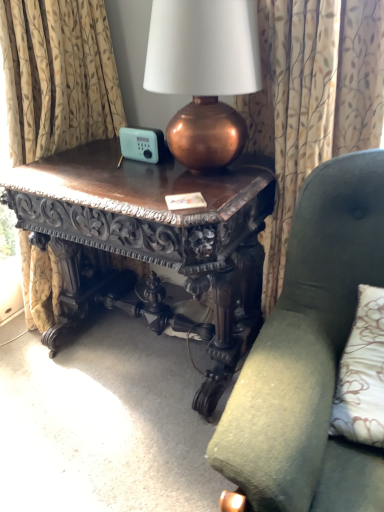
Question: Is patterned fabric curtain at upper center taller than polished dark wood table at center?

Choices:
 (A) no
 (B) yes

Answer: (B)

Question: From the image's perspective, would you say patterned fabric curtain at upper center is positioned over polished dark wood table at center?

Choices:
 (A) yes
 (B) no

Answer: (A)

Question: Is patterned fabric curtain at upper center positioned in front of polished dark wood table at center?

Choices:
 (A) no
 (B) yes

Answer: (B)

Question: Is patterned fabric curtain at upper center turned away from polished dark wood table at center?

Choices:
 (A) yes
 (B) no

Answer: (A)

Question: Can polished dark wood table at center be found inside patterned fabric curtain at upper center?

Choices:
 (A) yes
 (B) no

Answer: (B)

Question: Considering their positions, is patterned fabric curtain at upper center located in front of or behind polished dark wood table at center?

Choices:
 (A) front
 (B) behind

Answer: (A)

Question: Is patterned fabric curtain at upper center inside the boundaries of polished dark wood table at center, or outside?

Choices:
 (A) inside
 (B) outside

Answer: (B)

Question: Considering the positions of patterned fabric curtain at upper center and polished dark wood table at center in the image, is patterned fabric curtain at upper center wider or thinner than polished dark wood table at center?

Choices:
 (A) wide
 (B) thin

Answer: (B)

Question: In the image, is patterned fabric curtain at upper center on the left side or the right side of polished dark wood table at center?

Choices:
 (A) left
 (B) right

Answer: (B)

Question: From a real-world perspective, is copper metallic lamp at upper center above or below polished dark wood table at center?

Choices:
 (A) below
 (B) above

Answer: (B)

Question: In terms of height, does copper metallic lamp at upper center look taller or shorter compared to polished dark wood table at center?

Choices:
 (A) tall
 (B) short

Answer: (B)

Question: Is copper metallic lamp at upper center wider or thinner than polished dark wood table at center?

Choices:
 (A) wide
 (B) thin

Answer: (B)

Question: From the image's perspective, is copper metallic lamp at upper center located above or below polished dark wood table at center?

Choices:
 (A) above
 (B) below

Answer: (A)

Question: From the image's perspective, is green fabric chair at center above or below polished dark wood table at center?

Choices:
 (A) below
 (B) above

Answer: (A)

Question: Considering the positions of green fabric chair at center and polished dark wood table at center in the image, is green fabric chair at center wider or thinner than polished dark wood table at center?

Choices:
 (A) wide
 (B) thin

Answer: (A)